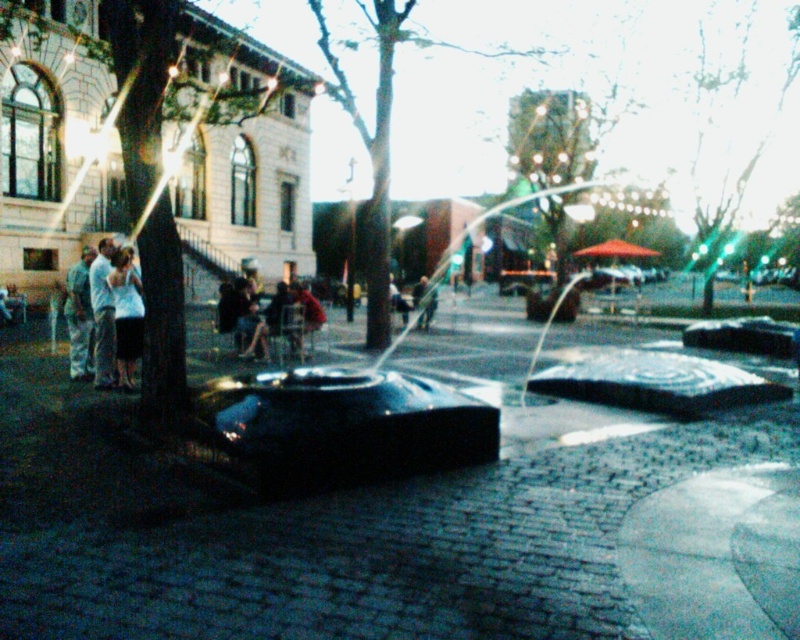
Which of these two, dark fabric jacket at center or light blue denim jeans at left, stands shorter?

Standing shorter between the two is light blue denim jeans at left.

Does dark fabric jacket at center have a greater width compared to light blue denim jeans at left?

Indeed, dark fabric jacket at center has a greater width compared to light blue denim jeans at left.

Is point (270, 320) closer to viewer compared to point (100, 353)?

No, (270, 320) is further to viewer.

Image resolution: width=800 pixels, height=640 pixels. I want to click on dark fabric jacket at center, so click(x=270, y=317).

Is black polished water feature at center above dark fabric jacket at center?

No, black polished water feature at center is not above dark fabric jacket at center.

Is black polished water feature at center wider than dark fabric jacket at center?

No.

This screenshot has width=800, height=640. I want to click on black polished water feature at center, so click(x=337, y=426).

Who is taller, light blue denim jeans at left or white cotton shirt at left?

With more height is white cotton shirt at left.

Can you confirm if light blue denim jeans at left is shorter than white cotton shirt at left?

Yes, light blue denim jeans at left is shorter than white cotton shirt at left.

Is point (100, 250) less distant than point (128, 268)?

No, (100, 250) is further to viewer.

I want to click on light blue denim jeans at left, so click(102, 314).